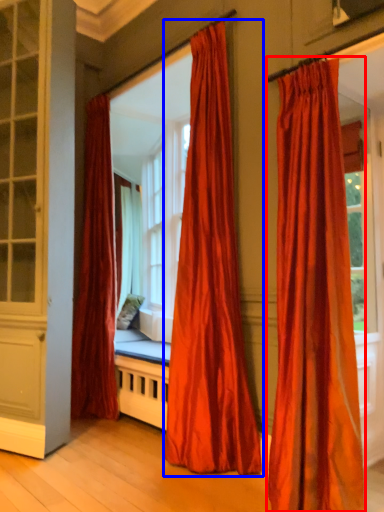
Question: Which object appears farthest to the camera in this image, curtain (highlighted by a red box) or curtain (highlighted by a blue box)?

Choices:
 (A) curtain
 (B) curtain

Answer: (B)